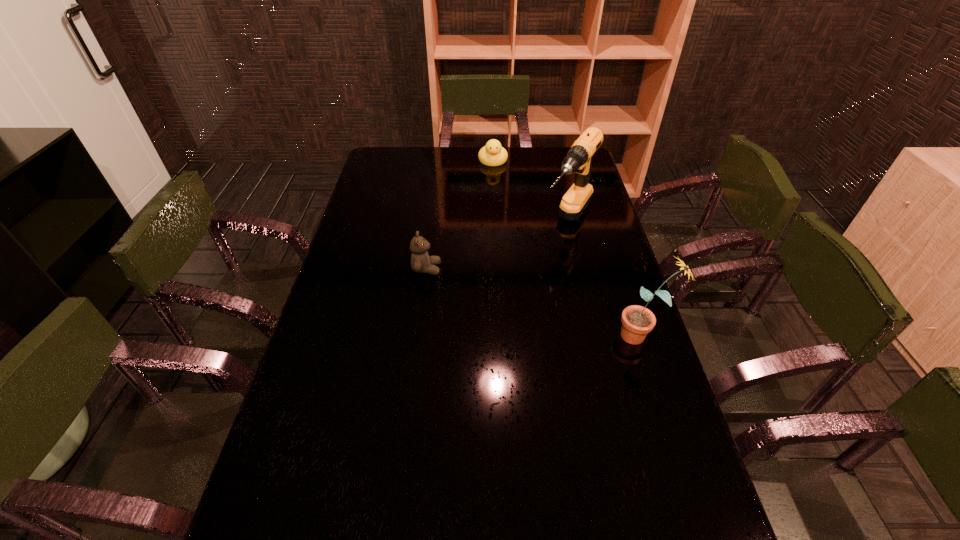
Where is `vacant area that lies between the shortest object and the sunflower`? This screenshot has width=960, height=540. vacant area that lies between the shortest object and the sunflower is located at coordinates (567, 247).

This screenshot has height=540, width=960. I want to click on free space between the sunflower and the leftmost object, so click(534, 302).

Identify the location of blank region between the third tallest object and the sunflower. The width and height of the screenshot is (960, 540). (534, 302).

The image size is (960, 540). In order to click on vacant area that lies between the second shortest object and the sunflower in this screenshot , I will do `click(534, 302)`.

Find the location of a particular element. This screenshot has height=540, width=960. free space between the third nearest object and the farthest object is located at coordinates (531, 192).

Locate an element on the screen. The width and height of the screenshot is (960, 540). the second closest object to the farthest object is located at coordinates (421, 262).

Where is `the third closest object to the second farthest object`? Image resolution: width=960 pixels, height=540 pixels. the third closest object to the second farthest object is located at coordinates (421, 262).

Where is `free space in the image that satisfies the following two spatial constraints: 1. on the front side of the sunflower; 2. on the flower of the drill`? This screenshot has height=540, width=960. free space in the image that satisfies the following two spatial constraints: 1. on the front side of the sunflower; 2. on the flower of the drill is located at coordinates (594, 335).

What are the coordinates of `free spot that satisfies the following two spatial constraints: 1. on the front side of the sunflower; 2. on the flower of the second farthest object` in the screenshot? It's located at click(594, 335).

Locate an element on the screen. The image size is (960, 540). free space that satisfies the following two spatial constraints: 1. on the front side of the third object from right to left; 2. on the right side of the second farthest object is located at coordinates (495, 223).